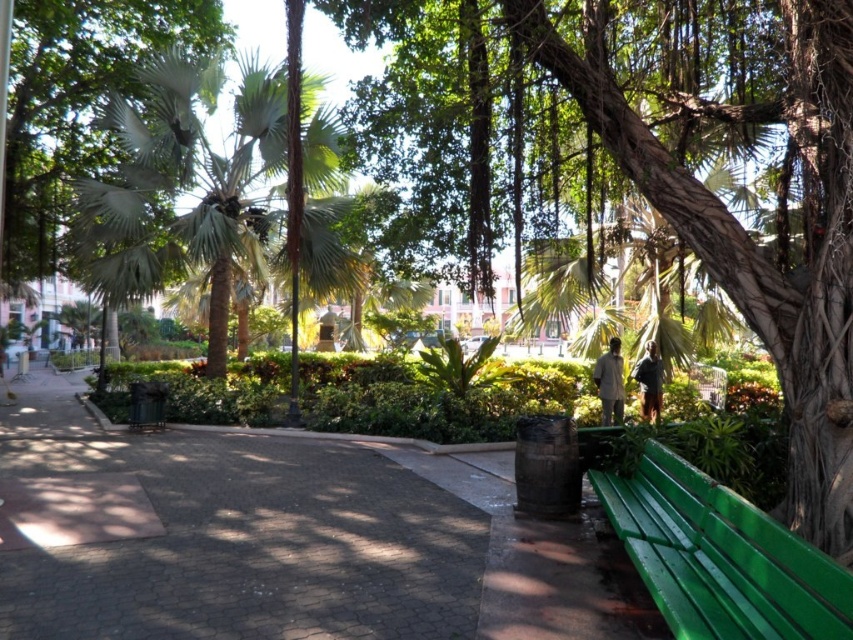
Is dark gray cobblestone at center bigger than green textured bench at right?

Yes, dark gray cobblestone at center is bigger than green textured bench at right.

Which of these two, dark gray cobblestone at center or green textured bench at right, stands taller?

green textured bench at right

Where is `dark gray cobblestone at center`? dark gray cobblestone at center is located at coordinates (221, 536).

The image size is (853, 640). Find the location of `dark gray cobblestone at center`. dark gray cobblestone at center is located at coordinates (221, 536).

Does dark gray cobblestone at center appear on the right side of light brown fabric shirt at center?

No, dark gray cobblestone at center is not to the right of light brown fabric shirt at center.

Who is higher up, dark gray cobblestone at center or light brown fabric shirt at center?

Positioned higher is light brown fabric shirt at center.

Locate an element on the screen. dark gray cobblestone at center is located at coordinates (221, 536).

The width and height of the screenshot is (853, 640). Describe the element at coordinates (184, 188) in the screenshot. I see `green leafy palm tree at upper left` at that location.

Can you confirm if green leafy palm tree at upper left is positioned to the left of green painted wood bench at lower right?

Correct, you'll find green leafy palm tree at upper left to the left of green painted wood bench at lower right.

The image size is (853, 640). I want to click on green leafy palm tree at upper left, so click(x=184, y=188).

I want to click on green leafy palm tree at upper left, so click(x=184, y=188).